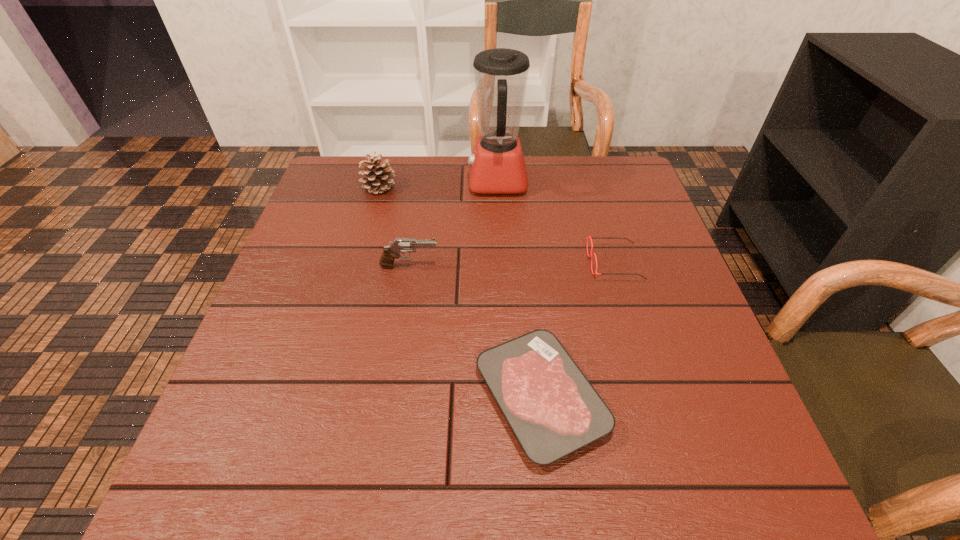
You are a GUI agent. You are given a task and a screenshot of the screen. Output one action in this format:
    pyautogui.click(x=<x>, y=<y>)
    Task: Click on the vacant space that is in between the shortest object and the pistol
    The height and width of the screenshot is (540, 960).
    Given the screenshot: What is the action you would take?
    pyautogui.click(x=475, y=332)

Where is `vacant space that's between the pistol and the blender`? The width and height of the screenshot is (960, 540). vacant space that's between the pistol and the blender is located at coordinates (453, 224).

The width and height of the screenshot is (960, 540). What are the coordinates of `free spot between the fourth object from right to left and the tallest object` in the screenshot? It's located at (453, 224).

Where is `free space between the pinecone and the nearest object`? The image size is (960, 540). free space between the pinecone and the nearest object is located at coordinates (460, 293).

This screenshot has width=960, height=540. I want to click on vacant area between the fourth object from right to left and the tallest object, so click(453, 224).

Locate an element on the screen. This screenshot has height=540, width=960. free space between the spectacles and the pinecone is located at coordinates (496, 225).

Find the location of a particular element. Image resolution: width=960 pixels, height=540 pixels. free space between the steak and the second object from left to right is located at coordinates (475, 332).

Identify the location of vacant region between the spectacles and the steak. (578, 330).

Find the location of a particular element. The height and width of the screenshot is (540, 960). free spot between the tallest object and the third tallest object is located at coordinates (453, 224).

Find the location of `free space between the tallest object and the shortest object`. free space between the tallest object and the shortest object is located at coordinates (519, 290).